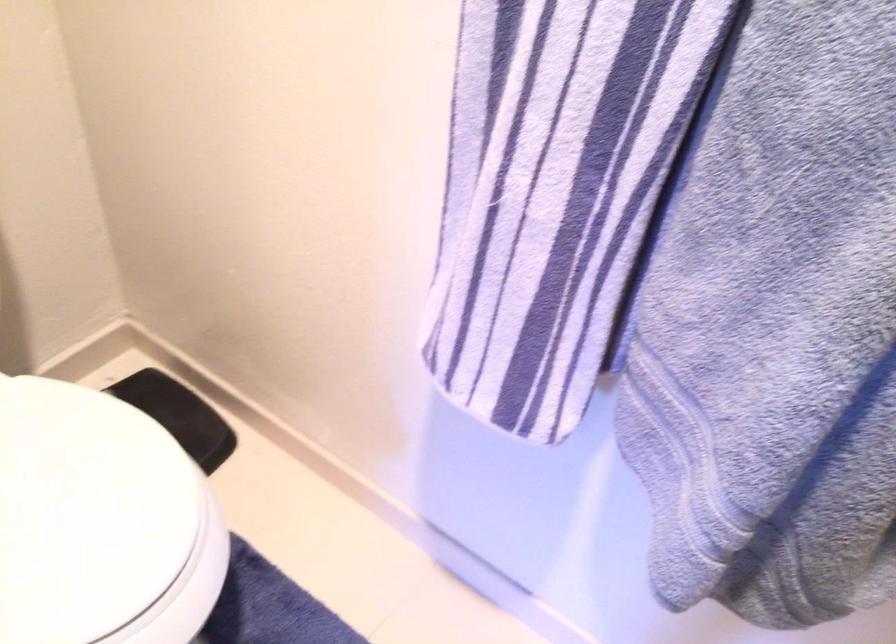
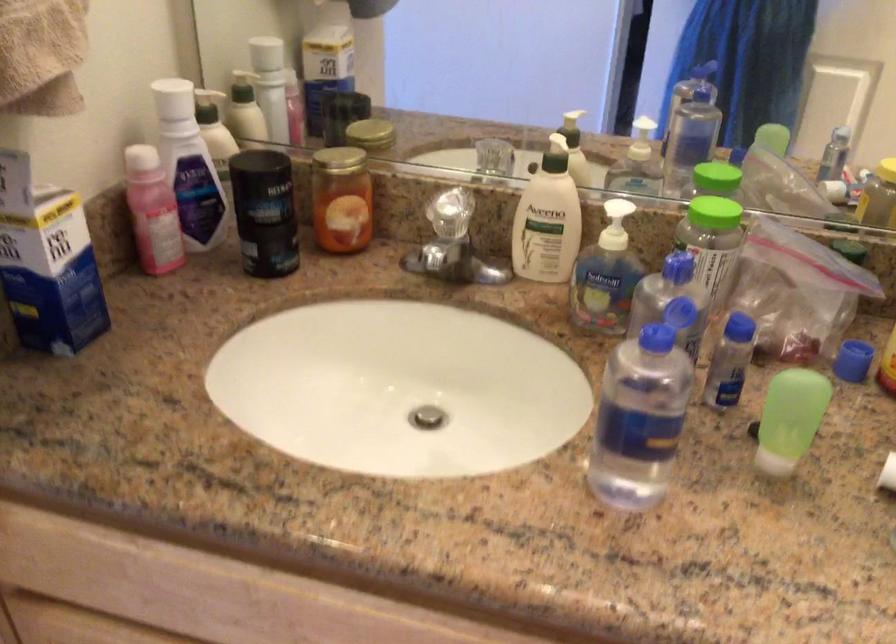
Question: The camera is either moving clockwise (left) or counter-clockwise (right) around the object. The first image is from the beginning of the video and the second image is from the end. Is the camera moving left or right when shooting the video?

Choices:
 (A) Left
 (B) Right

Answer: (B)